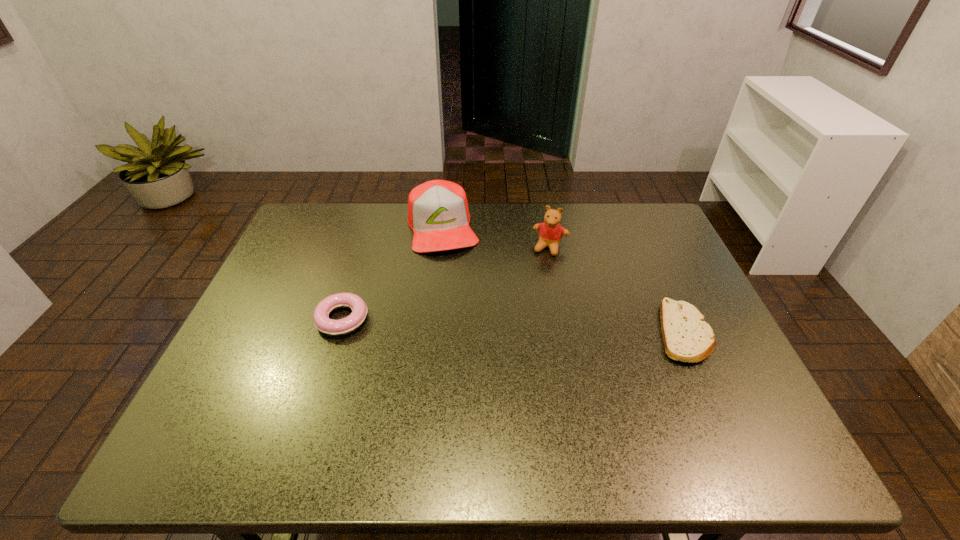
Find the location of a particular element. This screenshot has width=960, height=540. free region at the far left corner is located at coordinates (310, 220).

In the image, there is a desktop. At what (x,y) coordinates should I click in order to perform the action: click on free space at the far right corner. Please return your answer as a coordinate pair (x, y). Looking at the image, I should click on (625, 223).

Where is `blank space at the near right corner of the desktop`? The height and width of the screenshot is (540, 960). blank space at the near right corner of the desktop is located at coordinates (706, 390).

Find the location of a particular element. Image resolution: width=960 pixels, height=540 pixels. vacant space that's between the pita bread and the teddy bear is located at coordinates (617, 290).

The image size is (960, 540). I want to click on vacant area that lies between the baseball cap and the leftmost object, so click(x=393, y=273).

The height and width of the screenshot is (540, 960). Identify the location of vacant region between the shortest object and the second object from left to right. (563, 280).

This screenshot has width=960, height=540. Identify the location of free spot between the leftmost object and the shortest object. (513, 326).

I want to click on empty space between the shortest object and the leftmost object, so click(513, 326).

Locate an element on the screen. The width and height of the screenshot is (960, 540). free point between the shortest object and the doughnut is located at coordinates (513, 326).

Find the location of a particular element. The width and height of the screenshot is (960, 540). vacant area between the doughnut and the teddy bear is located at coordinates (446, 284).